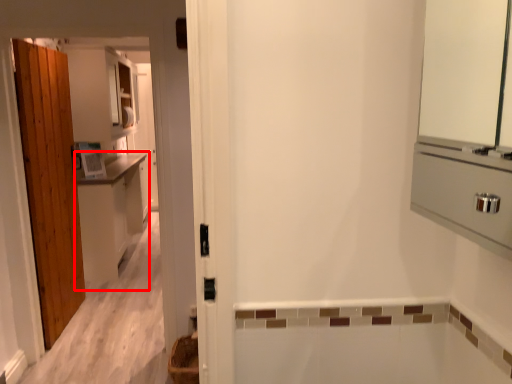
Question: Considering the relative positions of cabinetry (annotated by the red box) and basket in the image provided, where is cabinetry (annotated by the red box) located with respect to the staircase?

Choices:
 (A) right
 (B) left

Answer: (B)